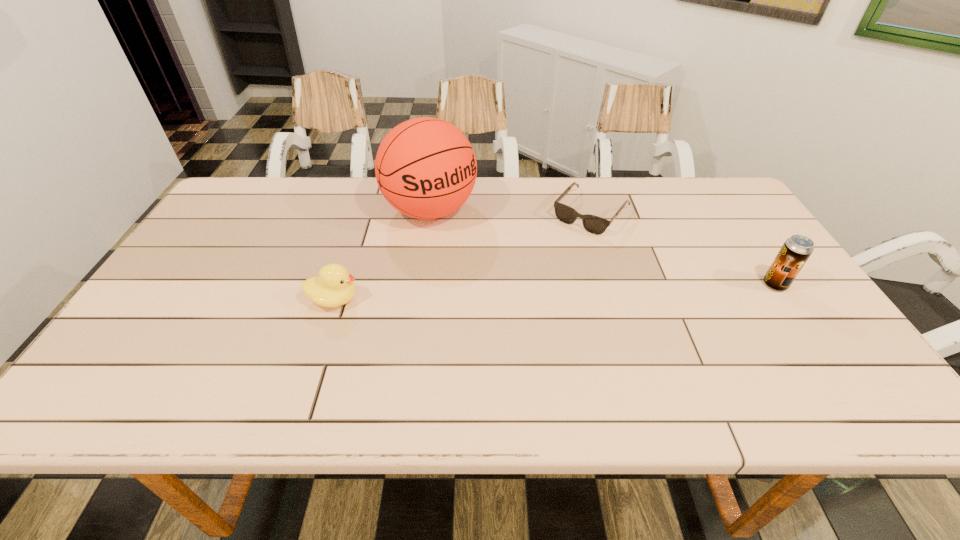
At what (x,y) coordinates should I click in order to perform the action: click on vacant space on the desktop that is between the second shortest object and the second tallest object and is positioned on the side with logo of the basketball. Please return your answer as a coordinate pair (x, y). Looking at the image, I should click on (510, 294).

The height and width of the screenshot is (540, 960). I want to click on free space on the desktop that is between the second shortest object and the rightmost object and is positioned at the front lenses of the sunglasses, so click(x=522, y=293).